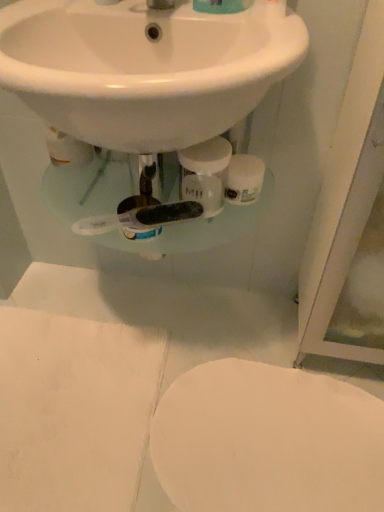
Measure the distance between white glossy toilet at lower right and camera.

The distance of white glossy toilet at lower right from camera is 36.34 inches.

Locate an element on the screen. Image resolution: width=384 pixels, height=512 pixels. white matte toilet paper at center is located at coordinates (244, 179).

Is white glossy sink at upper center situated inside white matte toilet paper at center or outside?

white glossy sink at upper center cannot be found inside white matte toilet paper at center.

Is white matte toilet paper at center at the back of white glossy sink at upper center?

white glossy sink at upper center does not have its back to white matte toilet paper at center.

Would you consider white glossy sink at upper center to be distant from white matte toilet paper at center?

No.

Is the depth of white glossy sink at upper center greater than that of white matte toilet paper at center?

No.

Looking at this image, considering the relative positions of white glossy toilet at lower right and white matte toilet paper at center in the image provided, is white glossy toilet at lower right to the left of white matte toilet paper at center from the viewer's perspective?

No, white glossy toilet at lower right is not to the left of white matte toilet paper at center.

Which of these two, white glossy toilet at lower right or white matte toilet paper at center, is thinner?

Thinner between the two is white matte toilet paper at center.

Between white glossy toilet at lower right and white matte toilet paper at center, which one is positioned in front?

white glossy toilet at lower right is in front.

Is white matte toilet paper at center with white glossy sink at upper center?

white matte toilet paper at center and white glossy sink at upper center are clearly separated.

Is white glossy sink at upper center located within white matte toilet paper at center?

No, white glossy sink at upper center is not surrounded by white matte toilet paper at center.

Which object is closer to the camera, white matte toilet paper at center or white glossy toilet at lower right?

white glossy toilet at lower right is more forward.

Which of these two, white matte toilet paper at center or white glossy toilet at lower right, is wider?

white glossy toilet at lower right.

Is white glossy toilet at lower right completely or partially inside white matte toilet paper at center?

That's incorrect, white glossy toilet at lower right is not inside white matte toilet paper at center.

Which object is positioned more to the right, white matte toilet paper at center or white glossy toilet at lower right?

white glossy toilet at lower right.

Is white glossy sink at upper center taller or shorter than white glossy toilet at lower right?

Considering their sizes, white glossy sink at upper center has more height than white glossy toilet at lower right.

Does white glossy sink at upper center have a larger size compared to white glossy toilet at lower right?

Correct, white glossy sink at upper center is larger in size than white glossy toilet at lower right.

Is white glossy sink at upper center situated inside white glossy toilet at lower right or outside?

white glossy sink at upper center cannot be found inside white glossy toilet at lower right.

How different are the orientations of white glossy sink at upper center and white glossy toilet at lower right in degrees?

There is a 1.45e-05-degree angle between the facing directions of white glossy sink at upper center and white glossy toilet at lower right.

Considering the relative sizes of white glossy toilet at lower right and white glossy sink at upper center in the image provided, is white glossy toilet at lower right wider than white glossy sink at upper center?

No, white glossy toilet at lower right is not wider than white glossy sink at upper center.

In the image, is white glossy toilet at lower right positioned in front of or behind white glossy sink at upper center?

Clearly, white glossy toilet at lower right is behind white glossy sink at upper center.

Is white glossy toilet at lower right bigger than white glossy sink at upper center?

Incorrect, white glossy toilet at lower right is not larger than white glossy sink at upper center.

How many degrees apart are the facing directions of white glossy toilet at lower right and white glossy sink at upper center?

Answer: white glossy toilet at lower right and white glossy sink at upper center are facing 1.45e-05 degrees away from each other.

Find the location of a particular element. toilet paper beneath the white glossy sink at upper center (from a real-world perspective) is located at coordinates (244, 179).

Where is `toilet that is in front of the white matte toilet paper at center`? toilet that is in front of the white matte toilet paper at center is located at coordinates (267, 441).

Which object lies further to the anchor point white glossy toilet at lower right, white matte toilet paper at center or white glossy sink at upper center?

white glossy sink at upper center.

Estimate the real-world distances between objects in this image. Which object is closer to white glossy sink at upper center, white glossy toilet at lower right or white matte toilet paper at center?

white matte toilet paper at center.

Looking at the image, which one is located further to white glossy toilet at lower right, white glossy sink at upper center or white matte toilet paper at center?

The object further to white glossy toilet at lower right is white glossy sink at upper center.

Considering their positions, is white matte toilet paper at center positioned further to white glossy sink at upper center than white glossy toilet at lower right?

Based on the image, white glossy toilet at lower right appears to be further to white glossy sink at upper center.

When comparing their distances from white matte toilet paper at center, does white glossy toilet at lower right or white glossy sink at upper center seem closer?

white glossy sink at upper center is closer to white matte toilet paper at center.

From the picture: Based on their spatial positions, is white glossy sink at upper center or white glossy toilet at lower right further from white matte toilet paper at center?

The object further to white matte toilet paper at center is white glossy toilet at lower right.

You are a GUI agent. You are given a task and a screenshot of the screen. Output one action in this format:
    pyautogui.click(x=<x>, y=<y>)
    Task: Click on the toilet paper between white glossy sink at upper center and white glossy toilet at lower right in the vertical direction
    The width and height of the screenshot is (384, 512).
    Given the screenshot: What is the action you would take?
    (x=244, y=179)